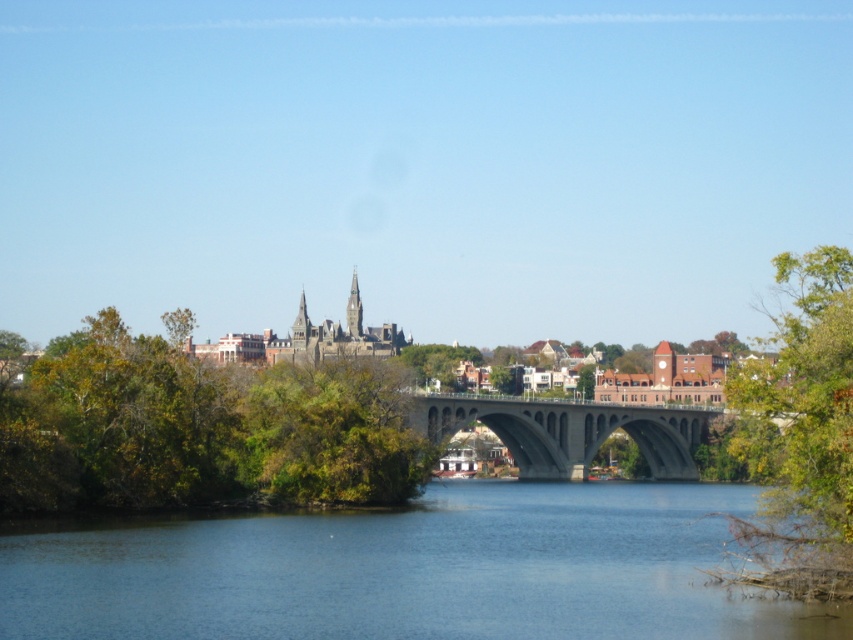
Question: Which object is positioned closest to the concrete bridge at center?

Choices:
 (A) green leafy trees at left
 (B) blue water at center
 (C) green leafy tree at right
 (D) gray stone spire at center

Answer: (A)

Question: Observing the image, what is the correct spatial positioning of blue water at center in reference to green leafy tree at right?

Choices:
 (A) right
 (B) left

Answer: (B)

Question: Does green leafy trees at left have a greater width compared to concrete bridge at center?

Choices:
 (A) no
 (B) yes

Answer: (B)

Question: Considering the real-world distances, which object is farthest from the concrete bridge at center?

Choices:
 (A) gray stone spire at center
 (B) green leafy trees at left

Answer: (A)

Question: Is green leafy tree at right thinner than concrete bridge at center?

Choices:
 (A) no
 (B) yes

Answer: (B)

Question: Which object is the farthest from the gray stone spire at center?

Choices:
 (A) blue water at center
 (B) green leafy tree at right
 (C) green leafy trees at left
 (D) concrete bridge at center

Answer: (A)